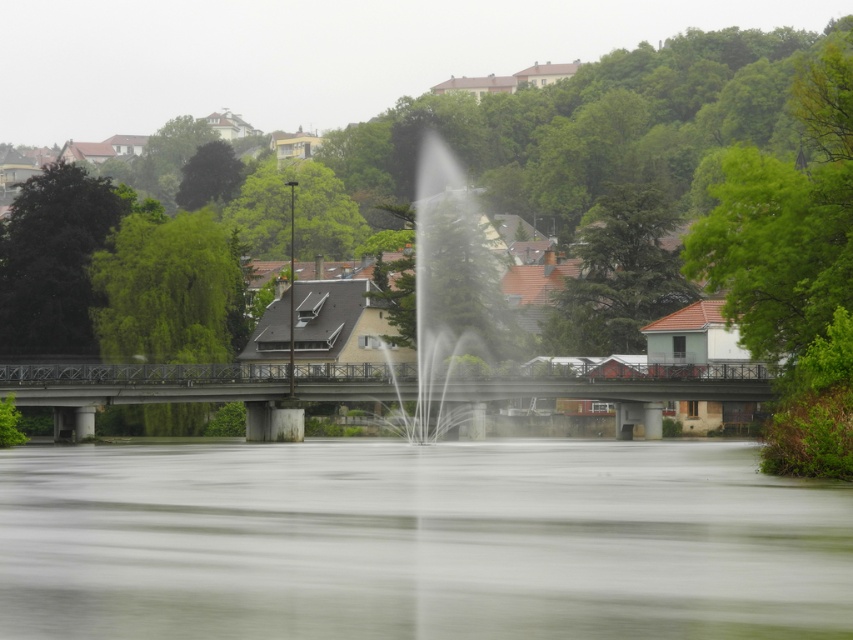
Question: Where is green leafy tree at center located in relation to clear water fountain at center in the image?

Choices:
 (A) above
 (B) below

Answer: (A)

Question: Which point is closer to the camera?

Choices:
 (A) clear water fountain at center
 (B) green leafy tree at center
 (C) green leafy tree at left
 (D) concrete bridge at center

Answer: (B)

Question: Which point is closer to the camera?

Choices:
 (A) (585, 241)
 (B) (505, 396)
 (C) (485, 276)

Answer: (B)

Question: Which of these objects is positioned farthest from the green leafy tree at left?

Choices:
 (A) concrete bridge at center
 (B) green leafy tree at center
 (C) clear water fountain at center
 (D) green textured tree at center

Answer: (B)

Question: Is green leafy tree at upper left thinner than green leafy tree at upper center?

Choices:
 (A) no
 (B) yes

Answer: (B)

Question: Is green leafy tree at center to the left of green leafy tree at upper left from the viewer's perspective?

Choices:
 (A) no
 (B) yes

Answer: (A)